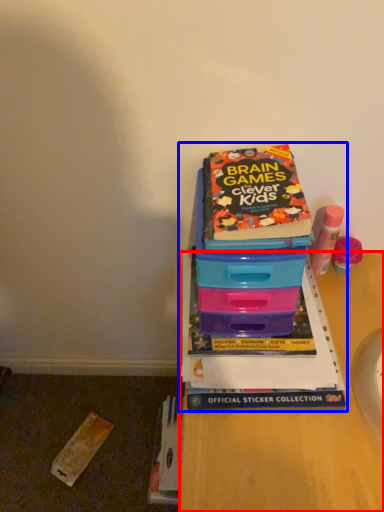
Question: Among these objects, which one is nearest to the camera, desk (highlighted by a red box) or book (highlighted by a blue box)?

Choices:
 (A) desk
 (B) book

Answer: (A)